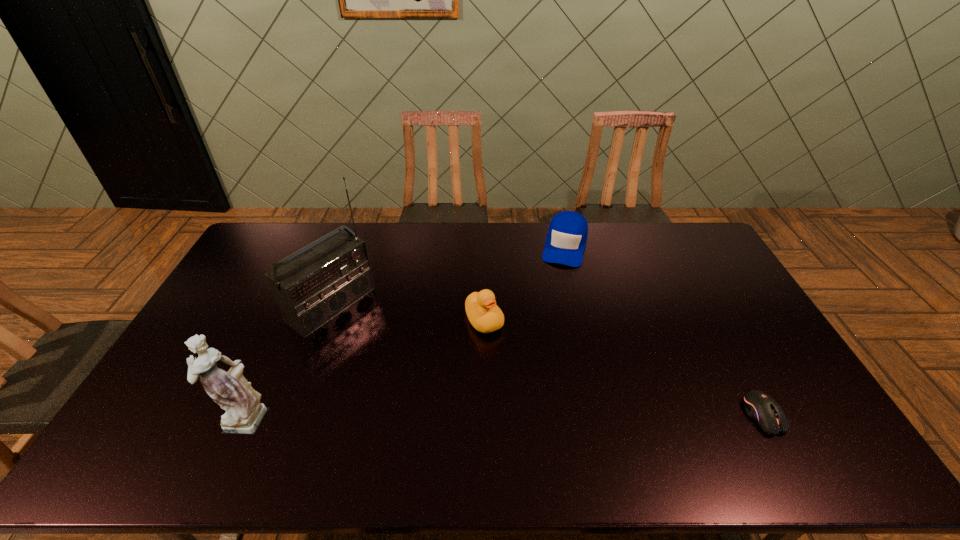
What are the coordinates of `figurine` in the screenshot? It's located at (244, 412).

At what (x,y) coordinates should I click in order to perform the action: click on the rightmost object. Please return your answer as a coordinate pair (x, y). The image size is (960, 540). Looking at the image, I should click on (763, 409).

At what (x,y) coordinates should I click in order to perform the action: click on computer mouse. Please return your answer as a coordinate pair (x, y). Looking at the image, I should click on (763, 409).

Where is `the tallest object`? The image size is (960, 540). the tallest object is located at coordinates (311, 288).

Find the location of a particular element. the third tallest object is located at coordinates (485, 316).

Where is `the third object from right to left`? The width and height of the screenshot is (960, 540). the third object from right to left is located at coordinates (485, 316).

The width and height of the screenshot is (960, 540). Find the location of `the fourth object from left to right`. the fourth object from left to right is located at coordinates (567, 235).

Locate an element on the screen. This screenshot has width=960, height=540. the farthest object is located at coordinates (567, 235).

I want to click on vacant space situated 0.080m on the front-facing side of the figurine, so click(188, 416).

You are a GUI agent. You are given a task and a screenshot of the screen. Output one action in this format:
    pyautogui.click(x=<x>, y=<y>)
    Task: Click on the vacant position located on the front-facing side of the figurine
    The height and width of the screenshot is (540, 960).
    Given the screenshot: What is the action you would take?
    pyautogui.click(x=139, y=416)